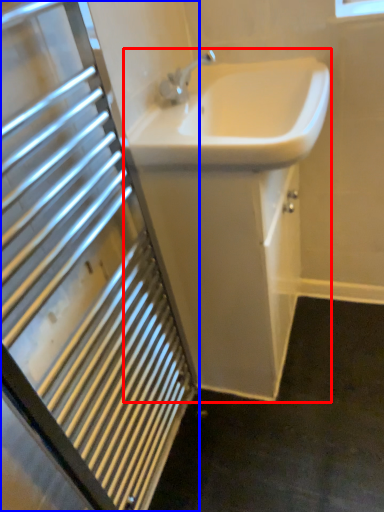
Question: Which object appears farthest to the camera in this image, sink (highlighted by a red box) or bathroom cabinet (highlighted by a blue box)?

Choices:
 (A) sink
 (B) bathroom cabinet

Answer: (A)